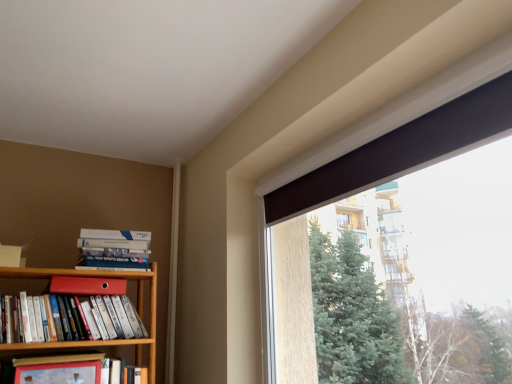
Question: Considering the positions of hardcover book at left, positioned as the 1th paperback book in bottom-to-top order, and matte red bookshelf at left, positioned as the second book in top-to-bottom order, in the image, is hardcover book at left, positioned as the 1th paperback book in bottom-to-top order, taller or shorter than matte red bookshelf at left, positioned as the second book in top-to-bottom order,?

Choices:
 (A) short
 (B) tall

Answer: (B)

Question: In the image, is hardcover book at left, positioned as the 1th paperback book in bottom-to-top order, positioned in front of or behind matte red bookshelf at left, which ranks as the second book in bottom-to-top order?

Choices:
 (A) front
 (B) behind

Answer: (A)

Question: Which object is the farthest from the matte red bookshelf at left, which ranks as the second book in bottom-to-top order?

Choices:
 (A) hardcover books at left, the 3th book positioned from the bottom
 (B) hardcover book at left, which is counted as the third book, starting from the top
 (C) brown matte window at upper right
 (D) matte red folder at upper left, which is the second paperback book from bottom to top
 (E) hardcover book at left, positioned as the 1th paperback book in bottom-to-top order

Answer: (C)

Question: Estimate the real-world distances between objects in this image. Which object is farther from the matte red bookshelf at left, which ranks as the second book in bottom-to-top order?

Choices:
 (A) hardcover book at left, which is counted as the third book, starting from the top
 (B) brown matte window at upper right
 (C) matte red folder at upper left, which is the second paperback book from bottom to top
 (D) hardcover books at left, marked as the 1th book in a top-to-bottom arrangement
 (E) hardcover book at left, the 1th paperback book positioned from the front

Answer: (B)